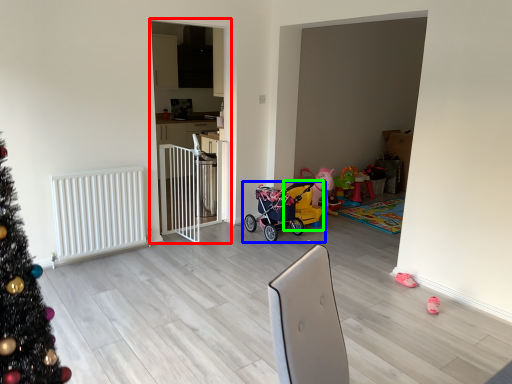
Question: Estimate the real-world distances between objects in this image. Which object is closer to screen door (highlighted by a red box), toy (highlighted by a blue box) or baby carriage (highlighted by a green box)?

Choices:
 (A) toy
 (B) baby carriage

Answer: (A)